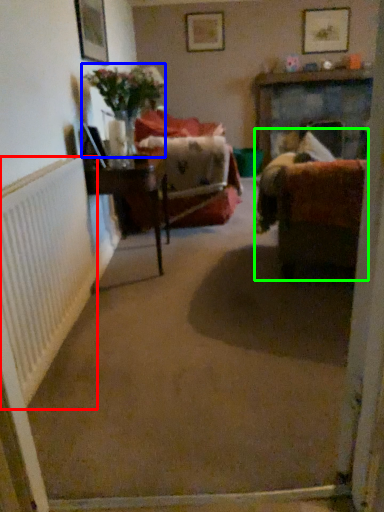
Question: Considering the real-world distances, which object is closest to radiator (highlighted by a red box)? floral arrangement (highlighted by a blue box) or studio couch (highlighted by a green box).

Choices:
 (A) floral arrangement
 (B) studio couch

Answer: (B)